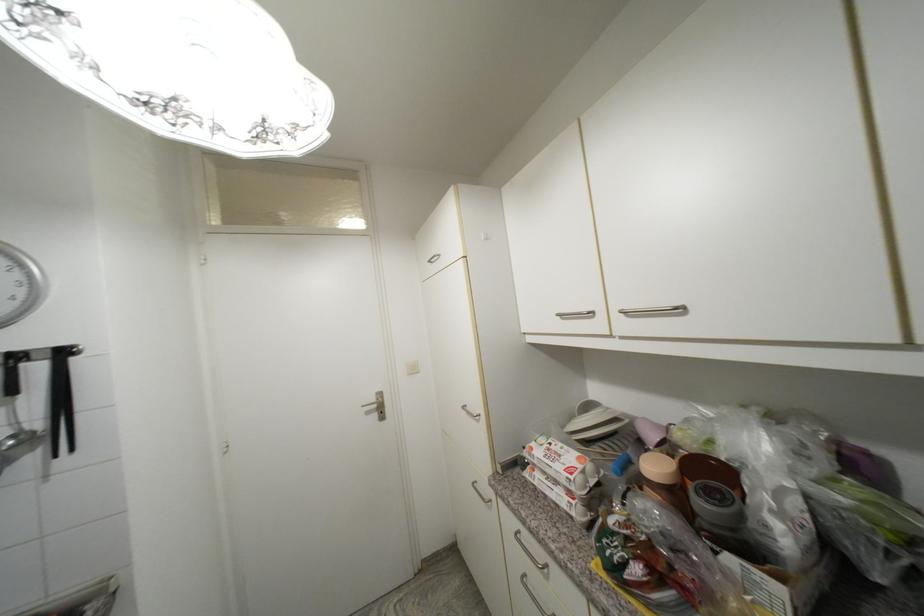
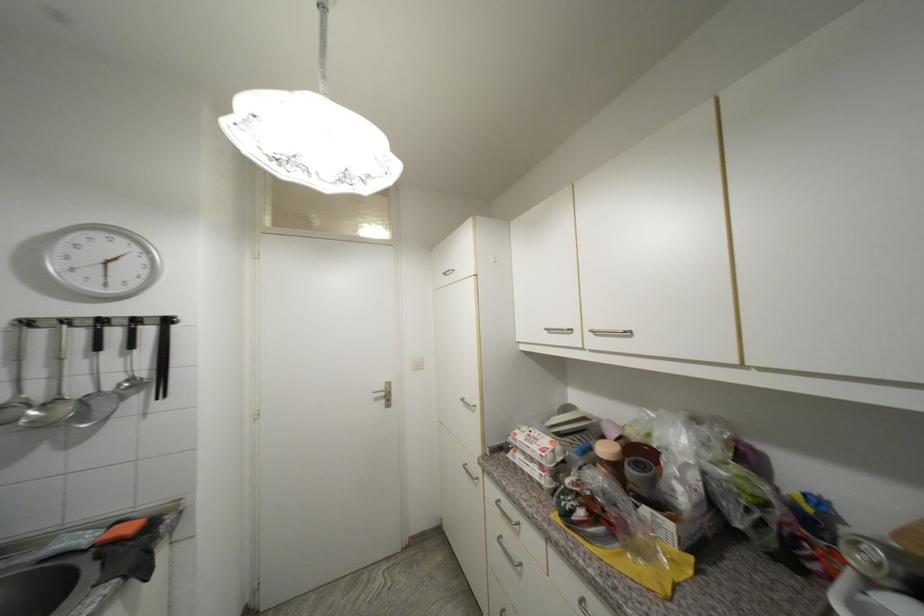
Find the pixel in the second image that matches point (469, 408) in the first image.

(468, 400)